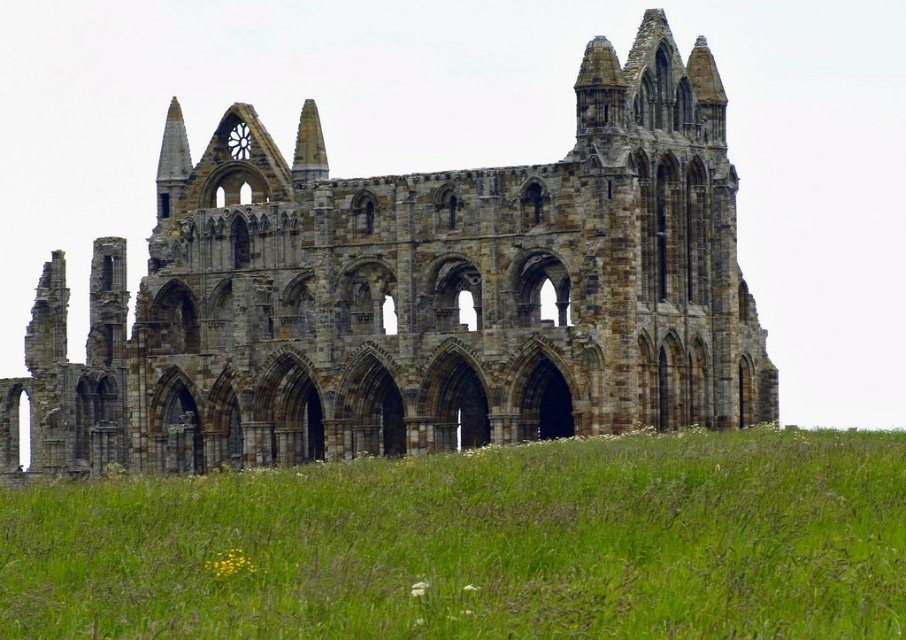
Does brown stone ruins at center have a lesser height compared to green grass at lower center?

Incorrect, brown stone ruins at center's height does not fall short of green grass at lower center's.

Does brown stone ruins at center have a greater height compared to green grass at lower center?

Indeed, brown stone ruins at center has a greater height compared to green grass at lower center.

Is point (551, 205) closer to viewer compared to point (263, 563)?

No, it is behind (263, 563).

This screenshot has height=640, width=906. I want to click on brown stone ruins at center, so click(x=412, y=294).